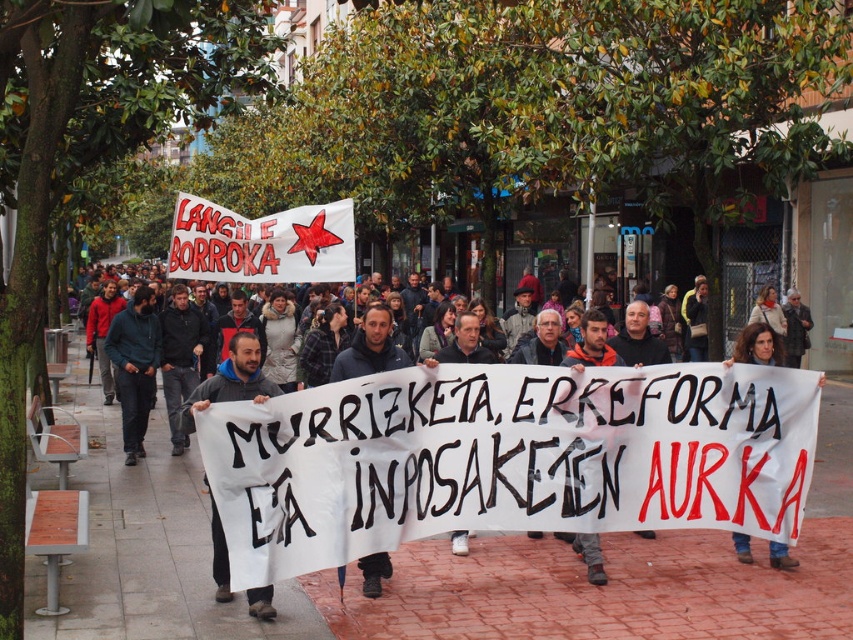
Locate an element on the screen. The width and height of the screenshot is (853, 640). dark gray hoodie at center is located at coordinates (230, 380).

Does point (186, 406) come farther from viewer compared to point (746, 340)?

No, (186, 406) is in front of (746, 340).

Is point (257, 368) positioned after point (740, 332)?

No, it is not.

Image resolution: width=853 pixels, height=640 pixels. What are the coordinates of `dark gray hoodie at center` in the screenshot? It's located at (230, 380).

Which of these two, dark blue hoodie at center or jeans at center, stands shorter?

Standing shorter between the two is jeans at center.

Between point (244, 545) and point (817, 385), which one is positioned in front?

Point (244, 545) is in front.

Find the location of a particular element. The image size is (853, 640). dark blue hoodie at center is located at coordinates (503, 458).

Locate an element on the screen. dark blue hoodie at center is located at coordinates (503, 458).

Can you confirm if black fabric banner at center is thinner than jeans at center?

Yes, black fabric banner at center is thinner than jeans at center.

Is black fabric banner at center to the left of jeans at center from the viewer's perspective?

Yes, black fabric banner at center is to the left of jeans at center.

This screenshot has width=853, height=640. What are the coordinates of `black fabric banner at center` in the screenshot? It's located at (370, 348).

This screenshot has height=640, width=853. I want to click on black fabric banner at center, so click(x=370, y=348).